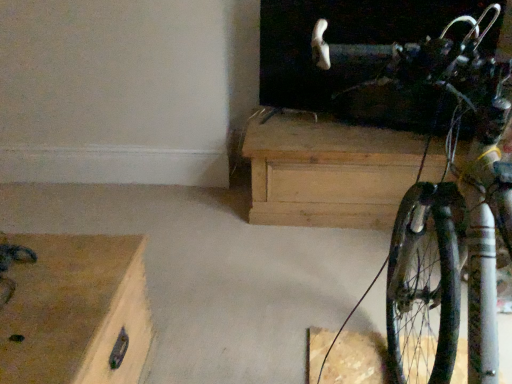
This screenshot has height=384, width=512. What are the coordinates of `shiny metallic bicycle at right` in the screenshot? It's located at (445, 207).

Identify the location of wooden chest at lower left, which is the 1th chest of drawers in bottom-to-top order. (74, 310).

The image size is (512, 384). Describe the element at coordinates (327, 172) in the screenshot. I see `natural wood chest at center, which is the first chest of drawers in back-to-front order` at that location.

The image size is (512, 384). In order to click on shiny metallic bicycle at right in this screenshot , I will do `click(445, 207)`.

Can you confirm if wooden chest at lower left, which is the 1th chest of drawers in bottom-to-top order, is thinner than shiny metallic bicycle at right?

Yes.

Image resolution: width=512 pixels, height=384 pixels. I want to click on bicycle to the right of wooden chest at lower left, the 2th chest of drawers viewed from the right, so click(445, 207).

Does wooden chest at lower left, which is the first chest of drawers from left to right, lie behind shiny metallic bicycle at right?

Yes.

From a real-world perspective, is wooden chest at lower left, arranged as the second chest of drawers when viewed from the top, located beneath shiny metallic bicycle at right?

Correct, in the physical world, wooden chest at lower left, arranged as the second chest of drawers when viewed from the top, is lower than shiny metallic bicycle at right.

Based on the photo, considering the relative positions of shiny metallic bicycle at right and wooden chest at lower left, which is the first chest of drawers from left to right, in the image provided, is shiny metallic bicycle at right to the left of wooden chest at lower left, which is the first chest of drawers from left to right, from the viewer's perspective?

Incorrect, shiny metallic bicycle at right is not on the left side of wooden chest at lower left, which is the first chest of drawers from left to right.

Is shiny metallic bicycle at right smaller than wooden chest at lower left, which is the first chest of drawers from left to right?

Actually, shiny metallic bicycle at right might be larger than wooden chest at lower left, which is the first chest of drawers from left to right.

From the image's perspective, which one is positioned lower, shiny metallic bicycle at right or wooden chest at lower left, which is the 1th chest of drawers in bottom-to-top order?

wooden chest at lower left, which is the 1th chest of drawers in bottom-to-top order, appears lower in the image.

From the picture: Is shiny metallic bicycle at right shorter than wooden chest at lower left, which is the first chest of drawers from left to right?

Incorrect, the height of shiny metallic bicycle at right does not fall short of that of wooden chest at lower left, which is the first chest of drawers from left to right.

Is wooden chest at lower left, which is the first chest of drawers from left to right, located outside natural wood chest at center, positioned as the second chest of drawers in bottom-to-top order?

That's correct, wooden chest at lower left, which is the first chest of drawers from left to right, is outside of natural wood chest at center, positioned as the second chest of drawers in bottom-to-top order.

From a real-world perspective, is wooden chest at lower left, which appears as the 2th chest of drawers when viewed from the back, above or below natural wood chest at center, arranged as the first chest of drawers when viewed from the right?

Clearly, from a real-world perspective, wooden chest at lower left, which appears as the 2th chest of drawers when viewed from the back, is below natural wood chest at center, arranged as the first chest of drawers when viewed from the right.

Which is behind, point (137, 346) or point (298, 213)?

The point (298, 213) is behind.

Considering the relative sizes of natural wood chest at center, which ranks as the first chest of drawers in top-to-bottom order, and shiny metallic bicycle at right in the image provided, is natural wood chest at center, which ranks as the first chest of drawers in top-to-bottom order, bigger than shiny metallic bicycle at right?

Actually, natural wood chest at center, which ranks as the first chest of drawers in top-to-bottom order, might be smaller than shiny metallic bicycle at right.

In the scene shown: Can you tell me how much natural wood chest at center, which ranks as the first chest of drawers in top-to-bottom order, and shiny metallic bicycle at right differ in facing direction?

They differ by 180 degrees in their facing directions.

Is point (340, 223) behind point (449, 214)?

Yes, point (340, 223) is behind point (449, 214).

Does natural wood chest at center, positioned as the second chest of drawers in bottom-to-top order, appear on the left side of shiny metallic bicycle at right?

In fact, natural wood chest at center, positioned as the second chest of drawers in bottom-to-top order, is to the right of shiny metallic bicycle at right.

From a real-world perspective, is shiny metallic bicycle at right physically below natural wood chest at center, the second chest of drawers positioned from the left?

No, from a real-world perspective, shiny metallic bicycle at right is not under natural wood chest at center, the second chest of drawers positioned from the left.

Which is in front, point (314, 48) or point (400, 162)?

The point (314, 48) is closer to the camera.

From the image's perspective, is shiny metallic bicycle at right located beneath natural wood chest at center, which is counted as the 2th chest of drawers, starting from the front?

Yes, from the image's perspective, shiny metallic bicycle at right is beneath natural wood chest at center, which is counted as the 2th chest of drawers, starting from the front.

Is shiny metallic bicycle at right smaller than natural wood chest at center, arranged as the first chest of drawers when viewed from the right?

No, shiny metallic bicycle at right is not smaller than natural wood chest at center, arranged as the first chest of drawers when viewed from the right.

Is natural wood chest at center, which ranks as the first chest of drawers in top-to-bottom order, oriented towards wooden chest at lower left, which is the 1th chest of drawers in bottom-to-top order?

Yes, natural wood chest at center, which ranks as the first chest of drawers in top-to-bottom order, is aimed at wooden chest at lower left, which is the 1th chest of drawers in bottom-to-top order.

Based on their sizes in the image, would you say natural wood chest at center, which is the first chest of drawers in back-to-front order, is bigger or smaller than wooden chest at lower left, the 1th chest of drawers viewed from the front?

natural wood chest at center, which is the first chest of drawers in back-to-front order, is bigger than wooden chest at lower left, the 1th chest of drawers viewed from the front.

Looking at their sizes, would you say natural wood chest at center, which is the first chest of drawers in back-to-front order, is wider or thinner than wooden chest at lower left, arranged as the second chest of drawers when viewed from the top?

Considering their sizes, natural wood chest at center, which is the first chest of drawers in back-to-front order, looks broader than wooden chest at lower left, arranged as the second chest of drawers when viewed from the top.

Image resolution: width=512 pixels, height=384 pixels. Identify the location of bicycle located above the wooden chest at lower left, the 1th chest of drawers viewed from the front (from a real-world perspective). (445, 207).

From a real-world perspective, which chest of drawers is the 2nd one underneath the shiny metallic bicycle at right? Please provide its 2D coordinates.

[(74, 310)]

Looking at the image, which one is located further to natural wood chest at center, positioned as the second chest of drawers in bottom-to-top order, shiny metallic bicycle at right or wooden chest at lower left, the 2th chest of drawers viewed from the right?

Among the two, wooden chest at lower left, the 2th chest of drawers viewed from the right, is located further to natural wood chest at center, positioned as the second chest of drawers in bottom-to-top order.

Consider the image. Estimate the real-world distances between objects in this image. Which object is further from wooden chest at lower left, which appears as the 2th chest of drawers when viewed from the back, shiny metallic bicycle at right or natural wood chest at center, the second chest of drawers positioned from the left?

natural wood chest at center, the second chest of drawers positioned from the left, is further to wooden chest at lower left, which appears as the 2th chest of drawers when viewed from the back.

Which object lies nearer to the anchor point wooden chest at lower left, which appears as the 2th chest of drawers when viewed from the back, natural wood chest at center, which is counted as the 2th chest of drawers, starting from the front, or shiny metallic bicycle at right?

Based on the image, shiny metallic bicycle at right appears to be nearer to wooden chest at lower left, which appears as the 2th chest of drawers when viewed from the back.

Considering their positions, is wooden chest at lower left, the 1th chest of drawers viewed from the front, positioned further to natural wood chest at center, which ranks as the first chest of drawers in top-to-bottom order, than shiny metallic bicycle at right?

wooden chest at lower left, the 1th chest of drawers viewed from the front.

When comparing their distances from shiny metallic bicycle at right, does wooden chest at lower left, the 2th chest of drawers viewed from the right, or natural wood chest at center, positioned as the second chest of drawers in bottom-to-top order, seem closer?

natural wood chest at center, positioned as the second chest of drawers in bottom-to-top order, lies closer to shiny metallic bicycle at right than the other object.

Looking at this image, looking at the image, which one is located closer to shiny metallic bicycle at right, natural wood chest at center, which ranks as the first chest of drawers in top-to-bottom order, or wooden chest at lower left, which is the 1th chest of drawers in bottom-to-top order?

natural wood chest at center, which ranks as the first chest of drawers in top-to-bottom order, is closer to shiny metallic bicycle at right.

Where is `chest of drawers between shiny metallic bicycle at right and natural wood chest at center, which ranks as the first chest of drawers in top-to-bottom order, in the front-back direction`? The width and height of the screenshot is (512, 384). chest of drawers between shiny metallic bicycle at right and natural wood chest at center, which ranks as the first chest of drawers in top-to-bottom order, in the front-back direction is located at coordinates (74, 310).